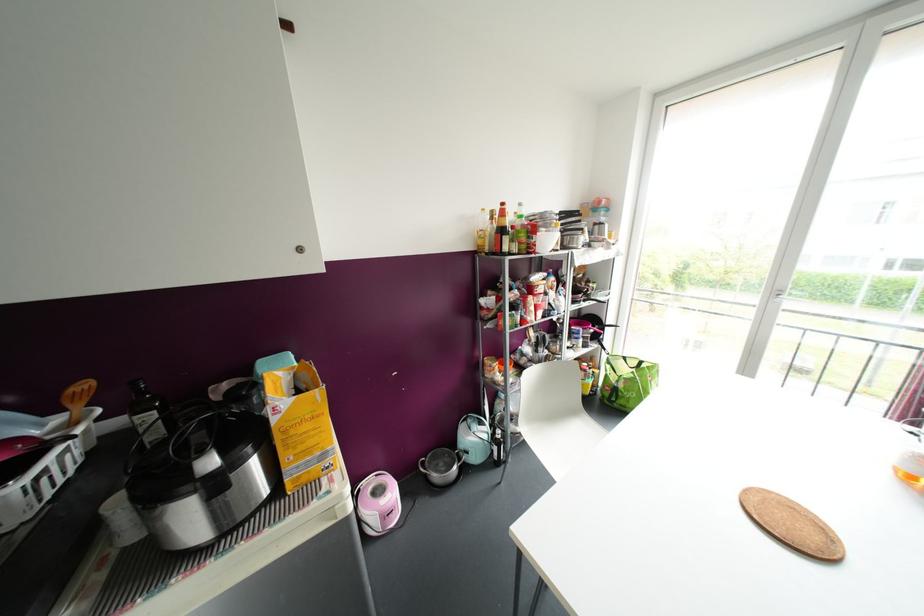
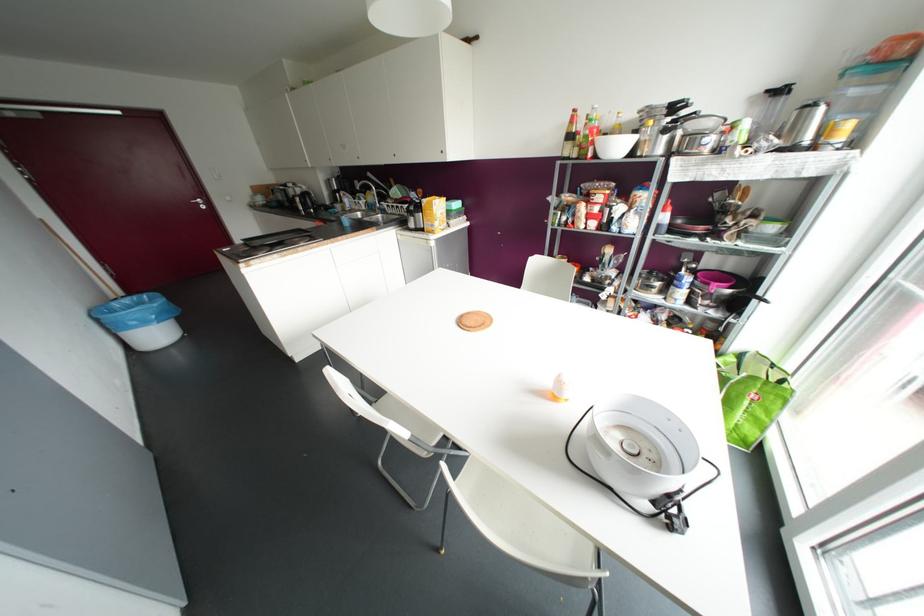
Where in the second image is the point corresponding to (624,358) from the first image?

(772, 365)